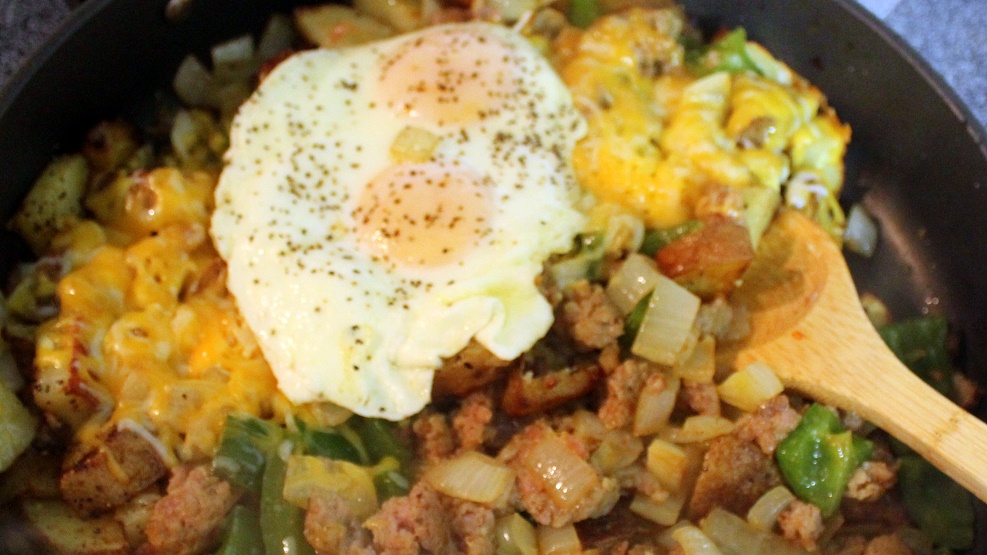
Find the location of a particular element. The image size is (987, 555). pot is located at coordinates (891, 123).